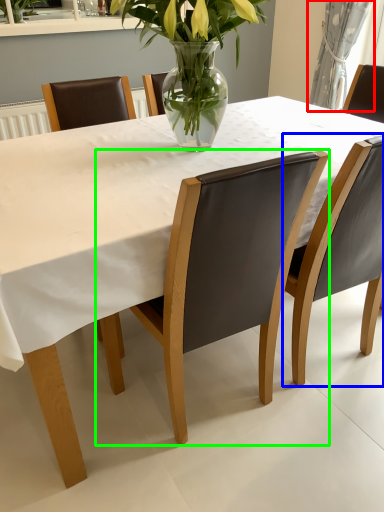
Question: Which object is the closest to the curtain (highlighted by a red box)? Choose among these: chair (highlighted by a blue box) or chair (highlighted by a green box).

Choices:
 (A) chair
 (B) chair

Answer: (A)